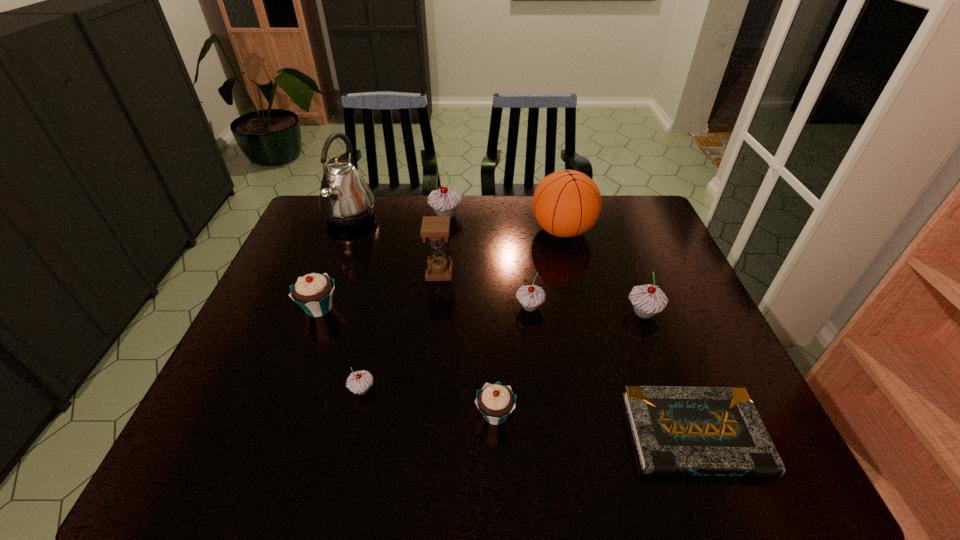
At what (x,y) coordinates should I click in order to perform the action: click on free spot located 0.230m on the front of the rightmost cupcake. Please return your answer as a coordinate pair (x, y). Looking at the image, I should click on (678, 403).

Identify the location of free location located 0.230m on the left of the third gray cupcake from left to right. The height and width of the screenshot is (540, 960). (431, 307).

Locate an element on the screen. The image size is (960, 540). vacant space situated 0.180m on the front of the leftmost cupcake is located at coordinates (292, 382).

Identify the location of vacant area situated 0.140m on the right of the smallest gray cupcake. (436, 390).

At what (x,y) coordinates should I click in order to perform the action: click on free space located on the back of the nearer teal cupcake. Please return your answer as a coordinate pair (x, y). Image resolution: width=960 pixels, height=540 pixels. Looking at the image, I should click on (492, 324).

What are the coordinates of `free space located 0.110m on the back of the shortest object` in the screenshot? It's located at (664, 356).

This screenshot has height=540, width=960. I want to click on kettle that is at the far edge, so click(345, 199).

Where is `basketball at the far edge`? basketball at the far edge is located at coordinates (567, 203).

Find the location of `cupcake located in the far edge section of the desktop`. cupcake located in the far edge section of the desktop is located at coordinates (x=445, y=201).

Identify the location of object that is at the near edge. The image size is (960, 540). (717, 431).